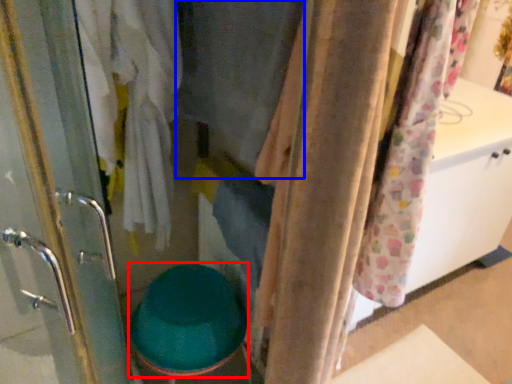
Question: Which point is closer to the camera, toilet bowl (highlighted by a red box) or clothing (highlighted by a blue box)?

Choices:
 (A) toilet bowl
 (B) clothing

Answer: (B)